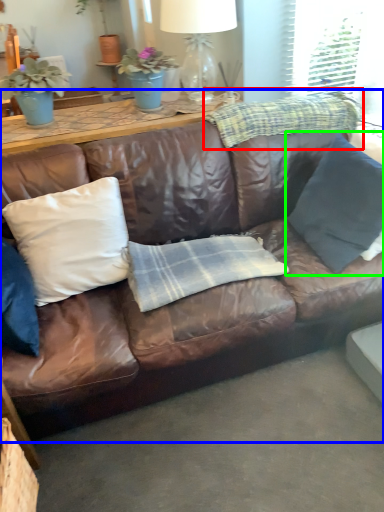
Question: Which object is positioned farthest from plaid (highlighted by a red box)? Select from studio couch (highlighted by a blue box) and pillow (highlighted by a green box).

Choices:
 (A) studio couch
 (B) pillow

Answer: (A)